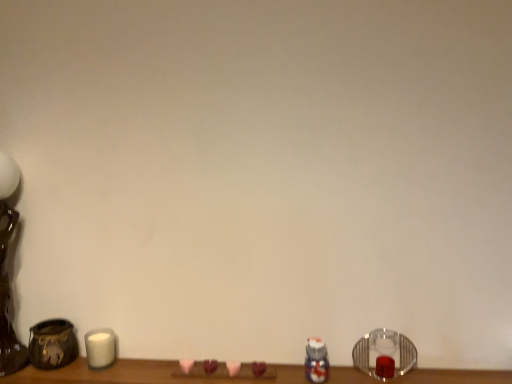
Question: In terms of width, does translucent plastic toy at lower right look wider or thinner when compared to brushed metal table lamp at left?

Choices:
 (A) thin
 (B) wide

Answer: (A)

Question: Is translucent plastic toy at lower right taller or shorter than brushed metal table lamp at left?

Choices:
 (A) tall
 (B) short

Answer: (B)

Question: Which object is the farthest from the brushed metal table lamp at left?

Choices:
 (A) matte brown vase at left
 (B) clear glass candle holder at lower right
 (C) white matte candle at lower left
 (D) translucent plastic toy at lower right

Answer: (B)

Question: Considering the real-world distances, which object is closest to the clear glass candle holder at lower right?

Choices:
 (A) translucent plastic toy at lower right
 (B) brushed metal table lamp at left
 (C) matte brown vase at left
 (D) white matte candle at lower left

Answer: (A)